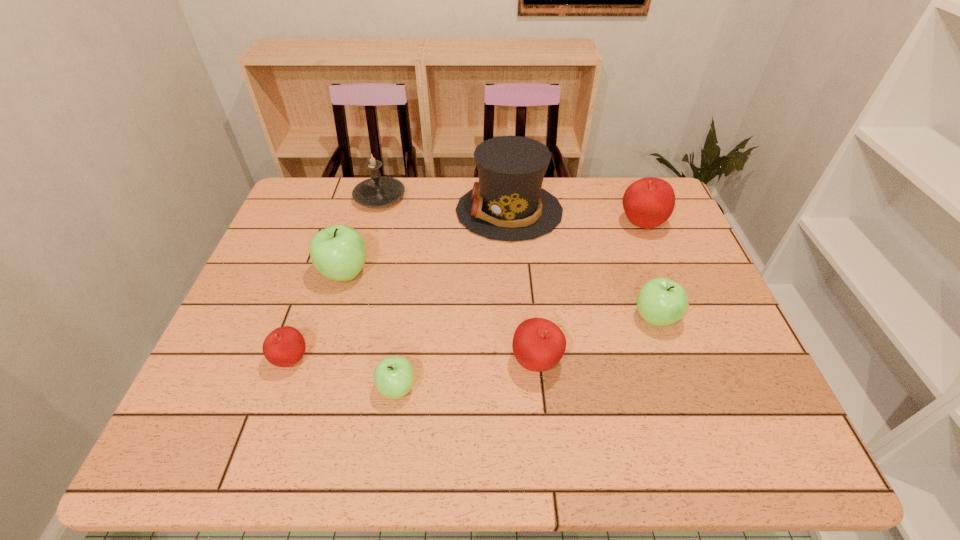
Image resolution: width=960 pixels, height=540 pixels. Find the location of `free spot located 0.230m on the front of the second nearest green apple`. free spot located 0.230m on the front of the second nearest green apple is located at coordinates (695, 431).

I want to click on free spot located on the back of the smallest green apple, so click(x=407, y=321).

In order to click on free space located 0.090m on the right of the leftmost red apple in this screenshot , I will do `click(350, 360)`.

This screenshot has height=540, width=960. I want to click on dress hat at the far edge, so click(x=507, y=203).

Find the location of a particular element. candle that is at the far edge is located at coordinates (377, 191).

Locate an element on the screen. This screenshot has height=540, width=960. apple that is at the far edge is located at coordinates (648, 202).

This screenshot has width=960, height=540. Find the location of `object positioned at the left edge`. object positioned at the left edge is located at coordinates (285, 346).

In order to click on object located at the far right corner in this screenshot , I will do `click(648, 202)`.

I want to click on blank space at the far edge of the desktop, so click(x=593, y=194).

Locate an element on the screen. The width and height of the screenshot is (960, 540). vacant space at the near edge of the desktop is located at coordinates (271, 451).